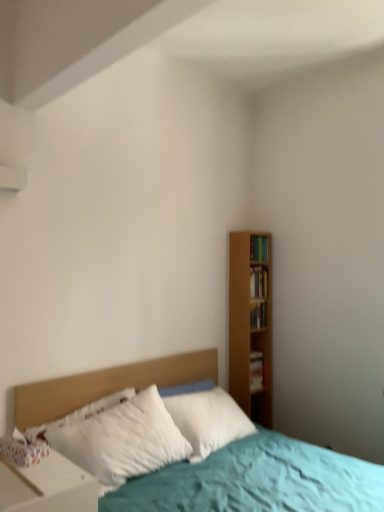
Question: Considering the relative sizes of white glossy nightstand at lower left and wooden bookshelf at right, which is the fourth book from bottom to top, in the image provided, is white glossy nightstand at lower left smaller than wooden bookshelf at right, which is the fourth book from bottom to top,?

Choices:
 (A) yes
 (B) no

Answer: (B)

Question: From a real-world perspective, does white glossy nightstand at lower left stand above wooden bookshelf at right, the 1th book in the top-to-bottom sequence?

Choices:
 (A) yes
 (B) no

Answer: (B)

Question: Could you tell me if white glossy nightstand at lower left is turned towards wooden bookshelf at right, the 1th book in the top-to-bottom sequence?

Choices:
 (A) no
 (B) yes

Answer: (A)

Question: Is wooden bookshelf at right, the 1th book in the top-to-bottom sequence, at the back of white glossy nightstand at lower left?

Choices:
 (A) no
 (B) yes

Answer: (A)

Question: Is white glossy nightstand at lower left far away from wooden bookshelf at right, the 1th book in the top-to-bottom sequence?

Choices:
 (A) no
 (B) yes

Answer: (B)

Question: Is wooden bookshelf at right, the 1th book in the top-to-bottom sequence, surrounded by white glossy nightstand at lower left?

Choices:
 (A) no
 (B) yes

Answer: (A)

Question: Is hardcover book at right, the fourth book when ordered from top to bottom, positioned beyond the bounds of wooden bookshelf at right, the 1th book in the top-to-bottom sequence?

Choices:
 (A) yes
 (B) no

Answer: (A)

Question: From the image's perspective, would you say hardcover book at right, the fourth book when ordered from top to bottom, is positioned over wooden bookshelf at right, which is the fourth book from bottom to top?

Choices:
 (A) no
 (B) yes

Answer: (A)

Question: Would you say wooden bookshelf at right, which is the fourth book from bottom to top, is part of hardcover book at right, which is counted as the first book, starting from the bottom,'s contents?

Choices:
 (A) yes
 (B) no

Answer: (B)

Question: Considering the relative positions of hardcover book at right, which is counted as the first book, starting from the bottom, and wooden bookshelf at right, the 1th book in the top-to-bottom sequence, in the image provided, is hardcover book at right, which is counted as the first book, starting from the bottom, in front of wooden bookshelf at right, the 1th book in the top-to-bottom sequence,?

Choices:
 (A) no
 (B) yes

Answer: (A)

Question: Considering the relative sizes of hardcover book at right, the fourth book when ordered from top to bottom, and wooden bookshelf at right, which is the fourth book from bottom to top, in the image provided, is hardcover book at right, the fourth book when ordered from top to bottom, thinner than wooden bookshelf at right, which is the fourth book from bottom to top,?

Choices:
 (A) no
 (B) yes

Answer: (A)

Question: Is hardcover book at right, the fourth book when ordered from top to bottom, far from wooden bookshelf at right, which is the fourth book from bottom to top?

Choices:
 (A) no
 (B) yes

Answer: (A)

Question: Considering the relative sizes of hardcover book at right, which is counted as the first book, starting from the bottom, and wooden bookshelf at right, arranged as the 3th book when viewed from the top, in the image provided, is hardcover book at right, which is counted as the first book, starting from the bottom, taller than wooden bookshelf at right, arranged as the 3th book when viewed from the top,?

Choices:
 (A) no
 (B) yes

Answer: (B)